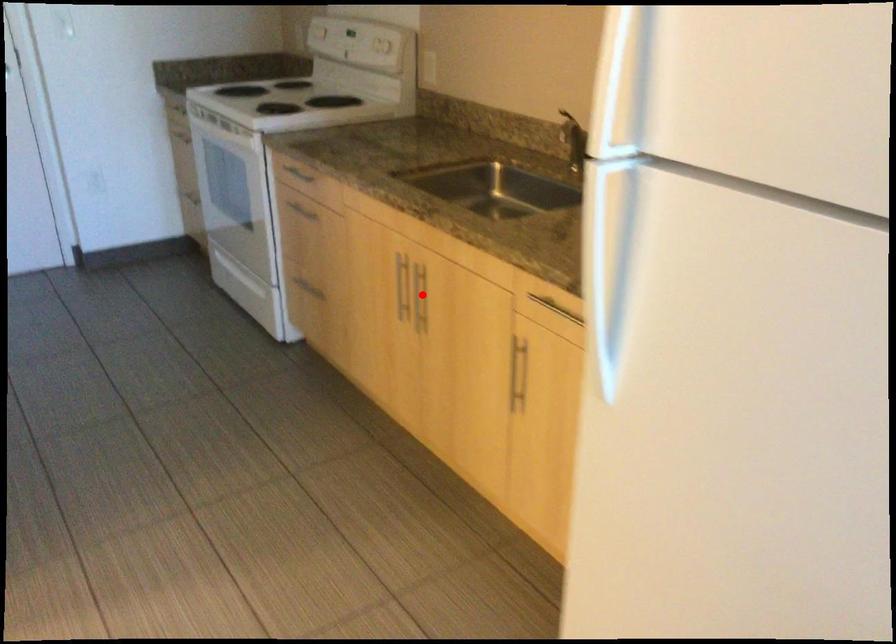
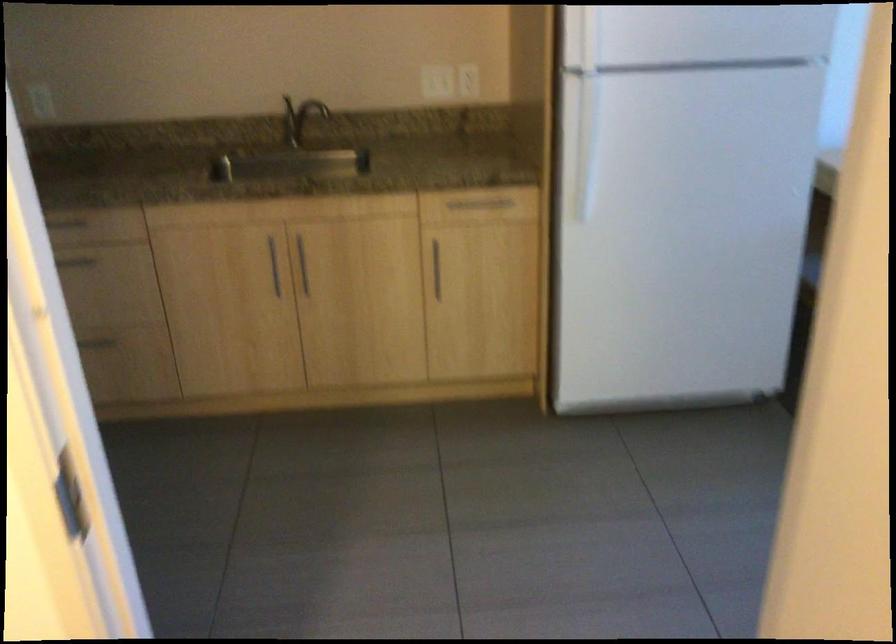
Question: I am providing you with two images of the same scene from different viewpoints. A red point is shown in image1. For the corresponding object point in image2, is it positioned nearer or farther from the camera?

Choices:
 (A) Nearer
 (B) Farther

Answer: (B)